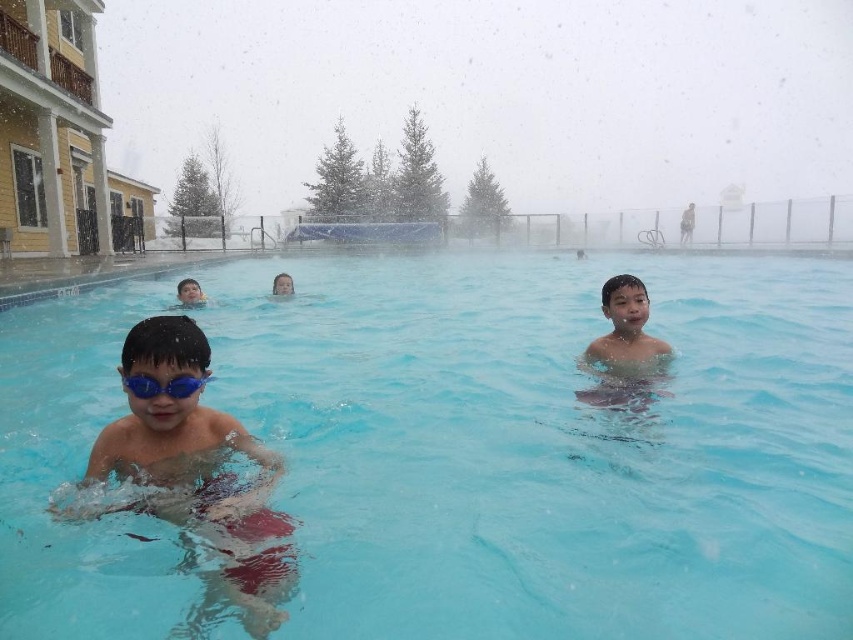
Question: Which of these objects is positioned closest to the matte blue goggles at center?

Choices:
 (A) blue matte goggles at upper center
 (B) clear blue water at center

Answer: (B)

Question: Can you confirm if matte blue goggles at center is positioned below blue matte goggles at center?

Choices:
 (A) no
 (B) yes

Answer: (B)

Question: Is matte blue goggles at center thinner than blue matte goggles at center?

Choices:
 (A) yes
 (B) no

Answer: (B)

Question: Does clear blue water at center have a larger size compared to blue matte goggles at center?

Choices:
 (A) yes
 (B) no

Answer: (A)

Question: Which object appears farthest from the camera in this image?

Choices:
 (A) smooth skin boy at center
 (B) clear blue water at center
 (C) matte blue goggles at center

Answer: (A)

Question: Which object is farther from the camera taking this photo?

Choices:
 (A) blue matte goggles at center
 (B) clear blue water at center
 (C) smooth skin boy at center

Answer: (C)